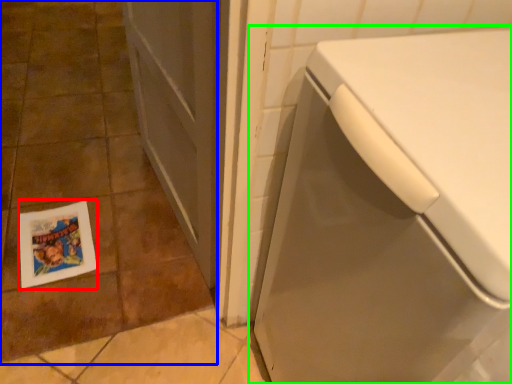
Question: Estimate the real-world distances between objects in this image. Which object is closer to flyer (highlighted by a red box), ceramic tile (highlighted by a blue box) or washing machine (highlighted by a green box)?

Choices:
 (A) ceramic tile
 (B) washing machine

Answer: (A)